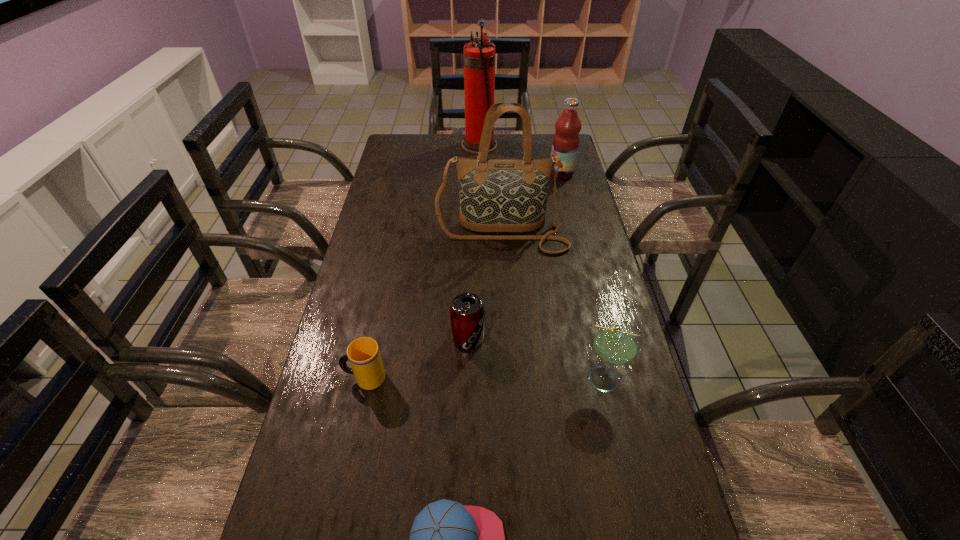
Where is `free spot located 0.260m on the front-facing side of the handbag`? The width and height of the screenshot is (960, 540). free spot located 0.260m on the front-facing side of the handbag is located at coordinates (507, 317).

Image resolution: width=960 pixels, height=540 pixels. In order to click on free space located 0.060m on the front label of the third tallest object in this screenshot , I will do `click(534, 173)`.

In order to click on vacant area situated 0.380m on the front label of the third tallest object in this screenshot , I will do `click(454, 173)`.

I want to click on vacant position located on the front label of the third tallest object, so click(x=537, y=173).

At what (x,y) coordinates should I click in order to perform the action: click on vacant space located 0.050m on the left of the martini. Please return your answer as a coordinate pair (x, y). The image size is (960, 540). Looking at the image, I should click on (563, 379).

Where is `free region located on the back of the fourth nearest object`? free region located on the back of the fourth nearest object is located at coordinates (468, 296).

Locate an element on the screen. The image size is (960, 540). vacant region located 0.050m on the side of the cup with the handle is located at coordinates [x=324, y=378].

Locate an element on the screen. object at the far edge is located at coordinates (479, 56).

Locate an element on the screen. The image size is (960, 540). object that is positioned at the left edge is located at coordinates (363, 353).

At what (x,y) coordinates should I click in order to perform the action: click on handbag situated at the right edge. Please return your answer as a coordinate pair (x, y). The height and width of the screenshot is (540, 960). Looking at the image, I should click on (495, 195).